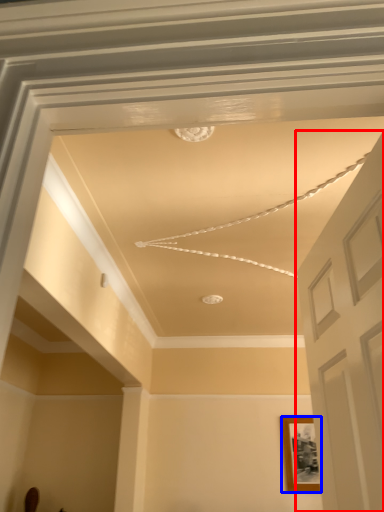
Question: Which object is further to the camera taking this photo, door (highlighted by a red box) or picture frame (highlighted by a blue box)?

Choices:
 (A) door
 (B) picture frame

Answer: (B)